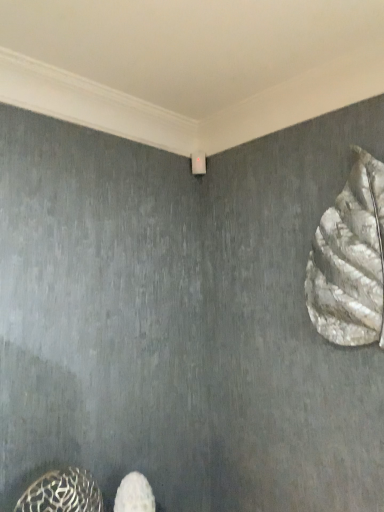
Question: Can you confirm if white fabric shoe at lower center is shorter than metallic patterned shoe at lower left, which is counted as the second animal, starting from the top?

Choices:
 (A) no
 (B) yes

Answer: (A)

Question: Is metallic patterned shoe at lower left, the 2th animal from the right, inside white fabric shoe at lower center?

Choices:
 (A) no
 (B) yes

Answer: (A)

Question: Does white fabric shoe at lower center turn towards metallic patterned shoe at lower left, the 1th animal when ordered from left to right?

Choices:
 (A) no
 (B) yes

Answer: (A)

Question: Is white fabric shoe at lower center turned away from metallic patterned shoe at lower left, the 1th animal when ordered from left to right?

Choices:
 (A) yes
 (B) no

Answer: (B)

Question: Considering the relative sizes of white fabric shoe at lower center and metallic patterned shoe at lower left, the 1th animal when ordered from left to right, in the image provided, is white fabric shoe at lower center thinner than metallic patterned shoe at lower left, the 1th animal when ordered from left to right,?

Choices:
 (A) no
 (B) yes

Answer: (A)

Question: From a real-world perspective, is white fabric shoe at lower center positioned above or below metallic patterned shoe at lower left, marked as the first animal in a bottom-to-top arrangement?

Choices:
 (A) below
 (B) above

Answer: (A)

Question: Based on their sizes in the image, would you say white fabric shoe at lower center is bigger or smaller than metallic patterned shoe at lower left, which is counted as the second animal, starting from the top?

Choices:
 (A) small
 (B) big

Answer: (A)

Question: Is white fabric shoe at lower center inside or outside of metallic patterned shoe at lower left, the 2th animal from the right?

Choices:
 (A) outside
 (B) inside

Answer: (A)

Question: Is white fabric shoe at lower center taller or shorter than metallic patterned shoe at lower left, marked as the first animal in a bottom-to-top arrangement?

Choices:
 (A) tall
 (B) short

Answer: (A)

Question: From the image's perspective, is white textured sculpture at right, which is the second animal in bottom-to-top order, positioned above or below white fabric shoe at lower center?

Choices:
 (A) above
 (B) below

Answer: (A)

Question: Looking at the image, does white textured sculpture at right, the 1th animal viewed from the right, seem bigger or smaller compared to white fabric shoe at lower center?

Choices:
 (A) big
 (B) small

Answer: (A)

Question: Is white textured sculpture at right, the 1th animal viewed from the right, in front of or behind white fabric shoe at lower center in the image?

Choices:
 (A) front
 (B) behind

Answer: (A)

Question: Looking at their shapes, would you say white textured sculpture at right, which ranks as the 1th animal in top-to-bottom order, is wider or thinner than white fabric shoe at lower center?

Choices:
 (A) wide
 (B) thin

Answer: (B)

Question: Considering the positions of point (370, 342) and point (33, 506), is point (370, 342) closer or farther from the camera than point (33, 506)?

Choices:
 (A) closer
 (B) farther

Answer: (B)

Question: Is white textured sculpture at right, which is the second animal in bottom-to-top order, inside or outside of metallic patterned shoe at lower left, the 1th animal when ordered from left to right?

Choices:
 (A) outside
 (B) inside

Answer: (A)